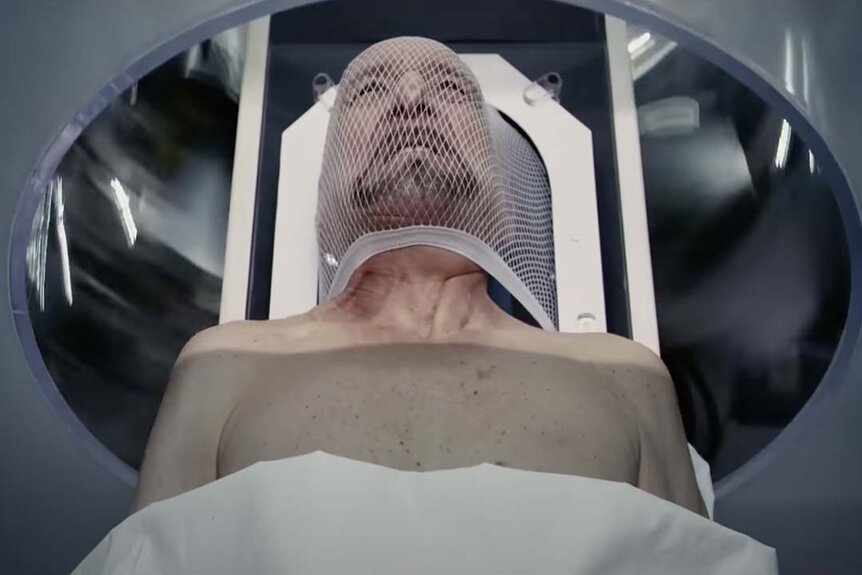
The image size is (862, 575). I want to click on sheet, so click(403, 527).